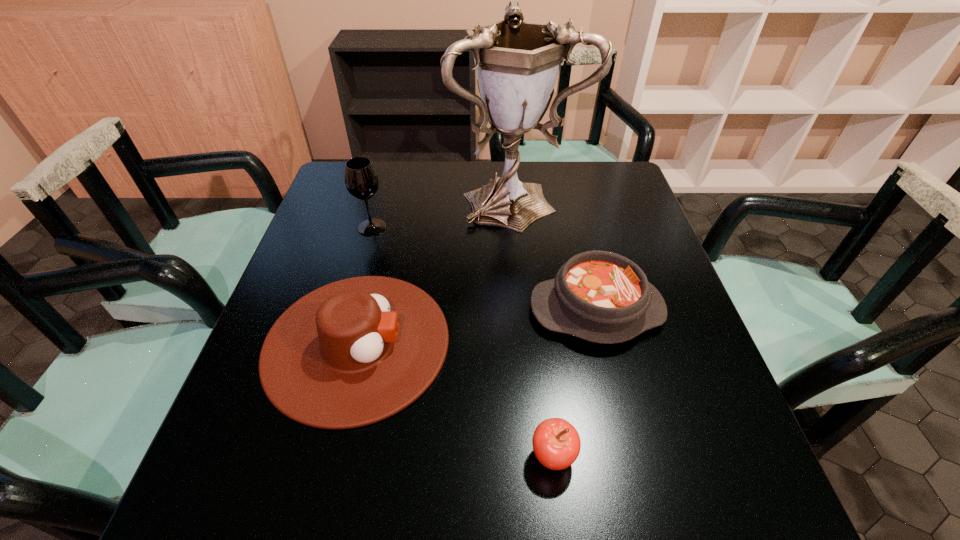
Identify the location of free space that satisfies the following two spatial constraints: 1. on the front-facing side of the cowboy hat; 2. on the back side of the nearest object. (330, 456).